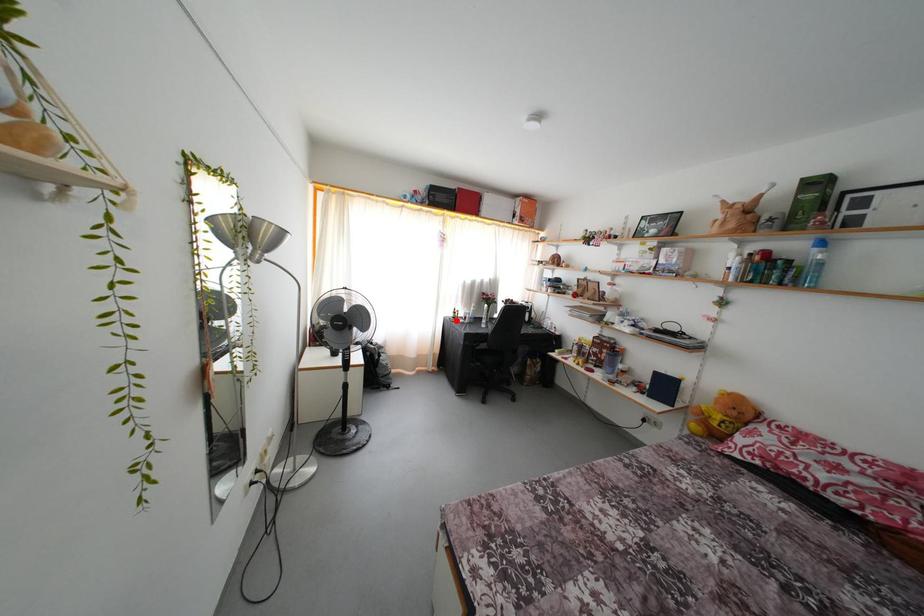
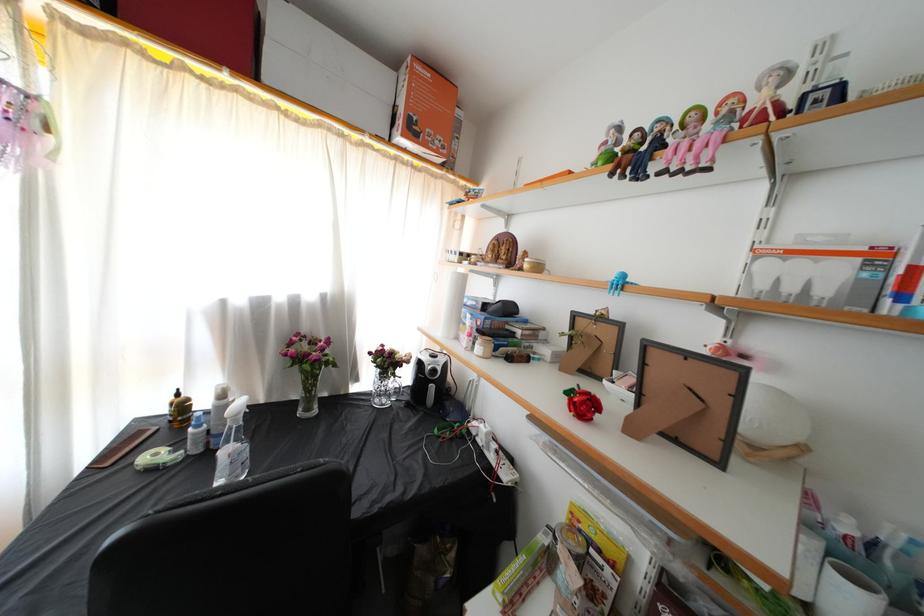
Where in the second image is the point corresponding to the highlighted location from the first image?

(171, 416)